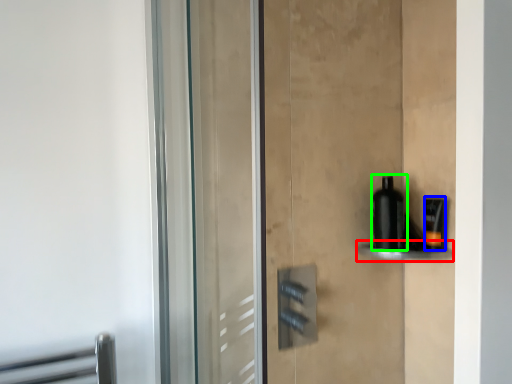
Question: Which is nearer to the shelf (highlighted by a red box)? toiletry (highlighted by a blue box) or bottle (highlighted by a green box).

Choices:
 (A) toiletry
 (B) bottle

Answer: (A)